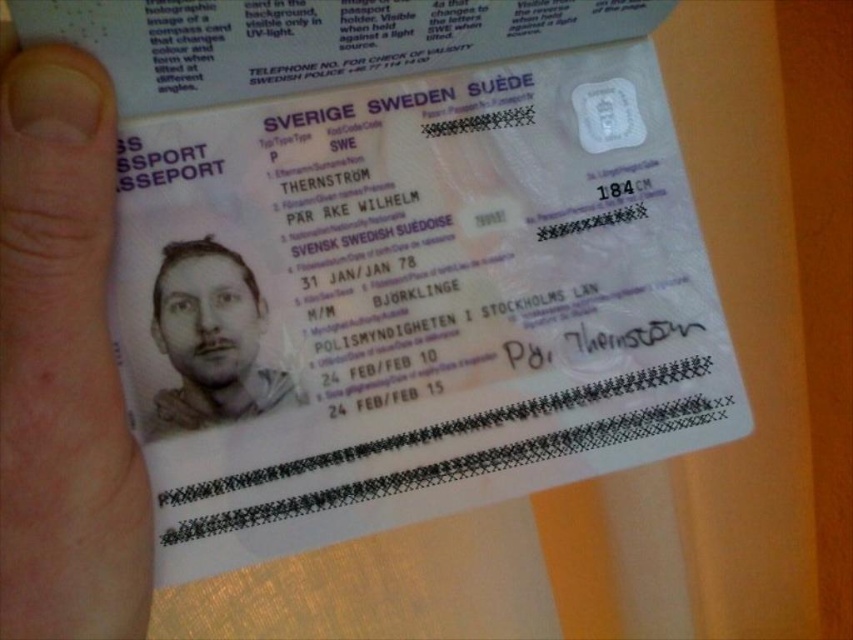
You are a passport control officer checking the Swedish passport. The passport has a photograph of a man on the left side. You notice a hand holding the passport. Which object is closer to the camera, the skin at upper left or the passport?

The skin at upper left is closer to the camera because it is only 16.36 inches away from the camera, while the passport is further away.

You are a passport inspector checking the Swedish passport. You notice a point at coordinates [62,364]. What is located at this point?

The point at coordinates [62,364] has skin at upper left.